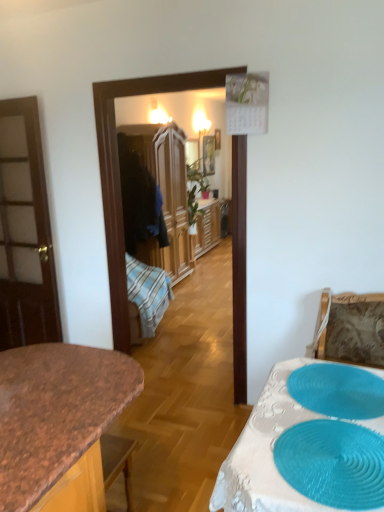
The image size is (384, 512). Identify the location of vacant space in front of blue textured placemat at lower right, marked as the 2th oval in a front-to-back arrangement. tap(332, 446).